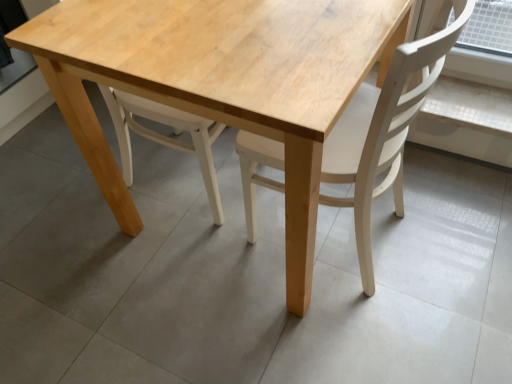
Question: From the image's perspective, is light wood chair at center positioned above or below natural wood table at center?

Choices:
 (A) above
 (B) below

Answer: (B)

Question: Considering the positions of point (393, 183) and point (37, 49), is point (393, 183) closer or farther from the camera than point (37, 49)?

Choices:
 (A) closer
 (B) farther

Answer: (B)

Question: From a real-world perspective, relative to natural wood table at center, is light wood chair at center vertically above or below?

Choices:
 (A) below
 (B) above

Answer: (B)

Question: Is natural wood table at center bigger or smaller than light wood chair at center?

Choices:
 (A) big
 (B) small

Answer: (A)

Question: In terms of width, does natural wood table at center look wider or thinner when compared to light wood chair at center?

Choices:
 (A) wide
 (B) thin

Answer: (A)

Question: Is point (162, 36) positioned closer to the camera than point (468, 13)?

Choices:
 (A) farther
 (B) closer

Answer: (A)

Question: From the image's perspective, is natural wood table at center located above or below light wood chair at center?

Choices:
 (A) above
 (B) below

Answer: (A)